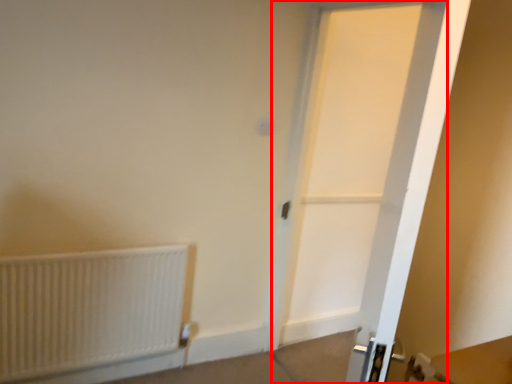
Question: From the image's perspective, what is the correct spatial positioning of door (annotated by the red box) in reference to radiator?

Choices:
 (A) below
 (B) above

Answer: (B)